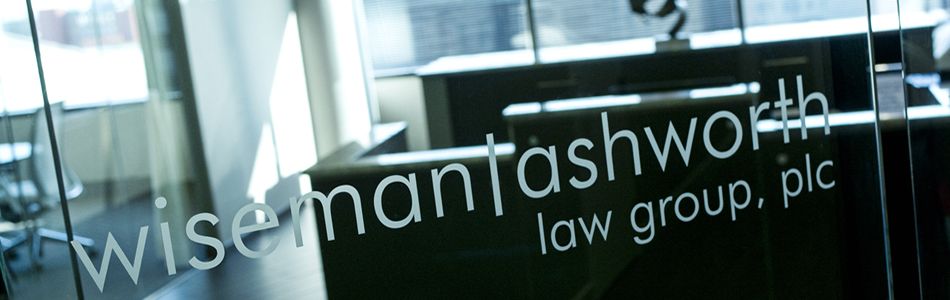
Locate an element on the screen. This screenshot has height=300, width=950. chair wheels is located at coordinates (95, 250), (36, 262), (5, 259).